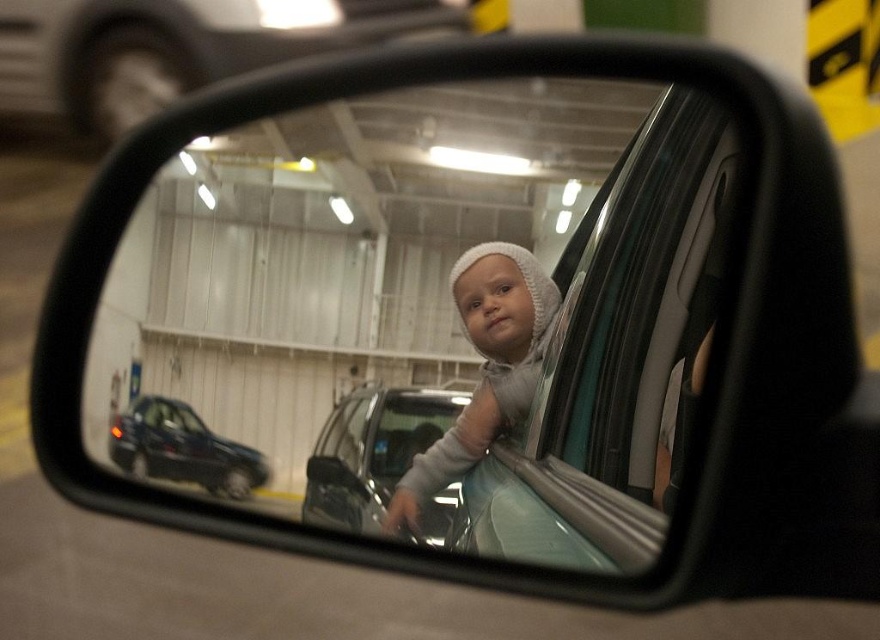
You are a driver looking at the side mirror of your car. You see a metallic car at upper center and a white knit hat at center in the reflection. Which object is closer to the mirror?

The white knit hat at center is behind the metallic car at upper center, so the metallic car at upper center is closer to the mirror.

You are a delivery person trying to determine the best path to avoid hitting the metallic car at upper center and the white knit hat at center. Which object is taller and needs to be considered first for clearance?

The metallic car at upper center is much taller than the white knit hat at center, so you should prioritize considering the metallic car at upper center first for clearance.

You are a driver who just entered an indoor parking garage. You look at your side mirror and see a metallic car at upper center and a white knit hat at center. Which object in the mirror is higher up?

The metallic car at upper center is positioned over the white knit hat at center, so the metallic car at upper center is higher up in the mirror.